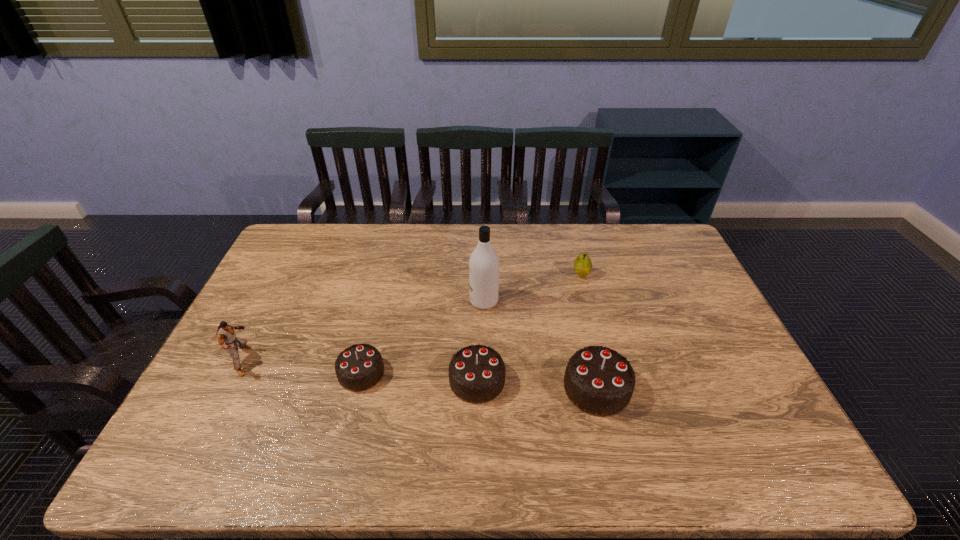
Where is `free space that satisfies the following two spatial constraints: 1. on the front-facing side of the second chocolate cake from left to right; 2. on the right side of the leftmost object`? free space that satisfies the following two spatial constraints: 1. on the front-facing side of the second chocolate cake from left to right; 2. on the right side of the leftmost object is located at coordinates (233, 380).